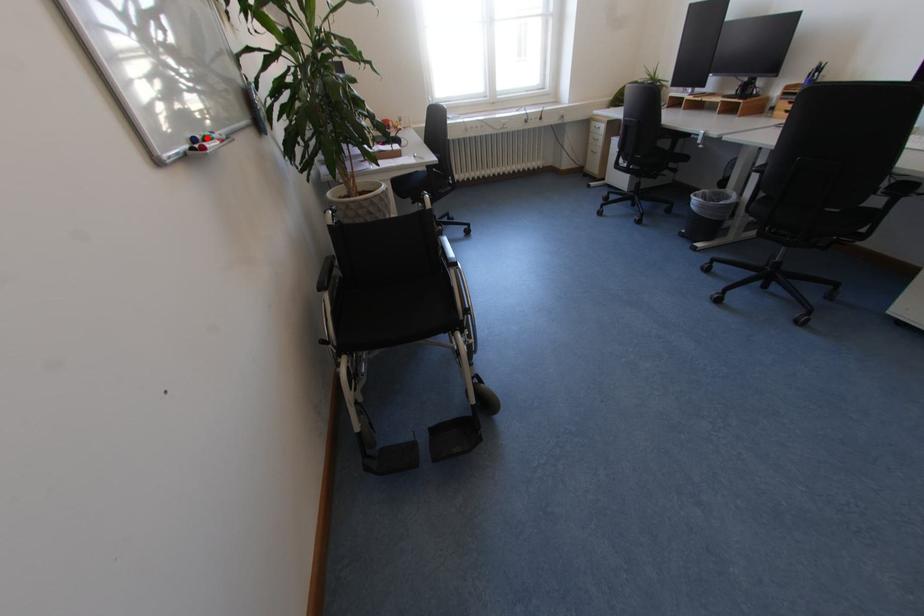
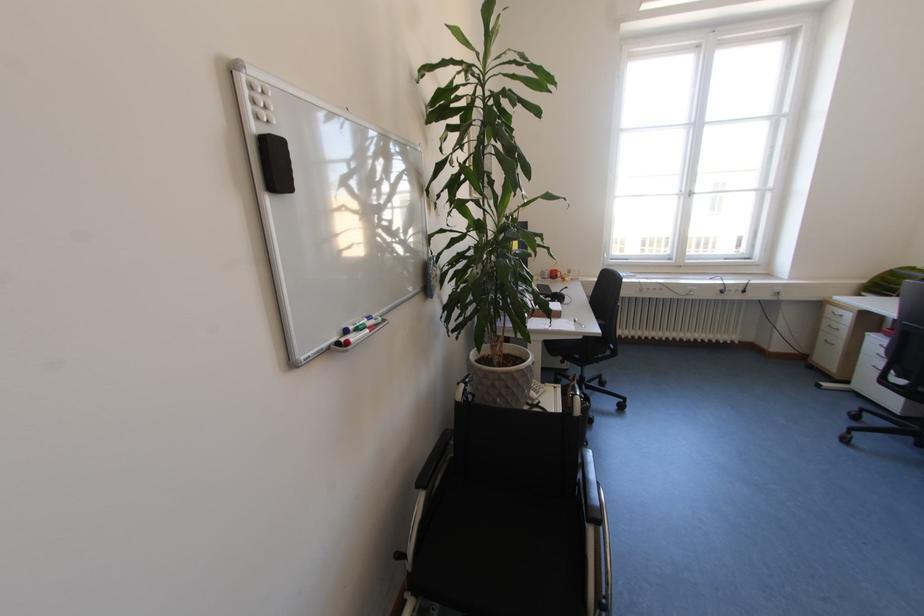
Find the pixel in the second image that matches the highlighted location in the first image.

(359, 329)